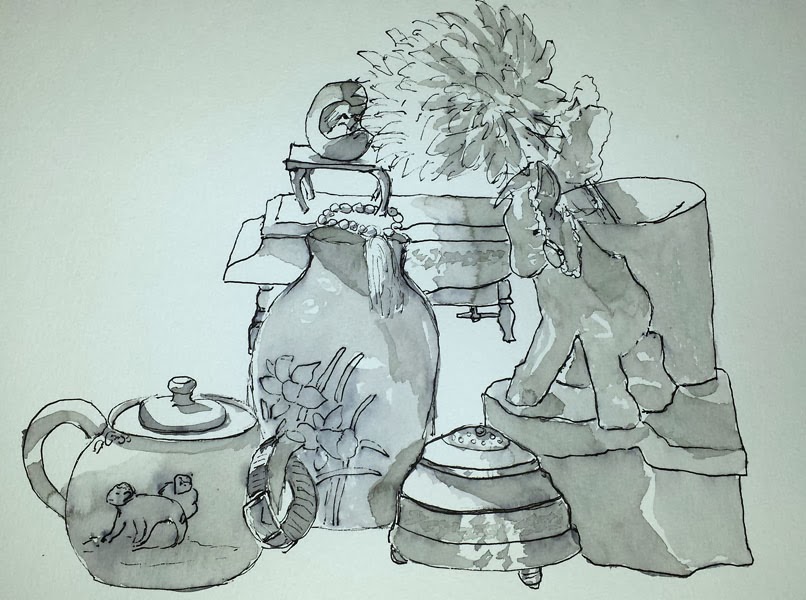
Locate an element on the screen. Image resolution: width=806 pixels, height=600 pixels. teapot spout is located at coordinates (275, 455).